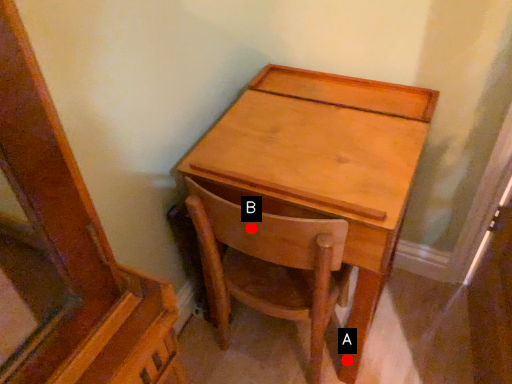
Question: Two points are circled on the image, labeled by A and B beside each circle. Which point is closer to the camera taking this photo?

Choices:
 (A) A is closer
 (B) B is closer

Answer: (B)